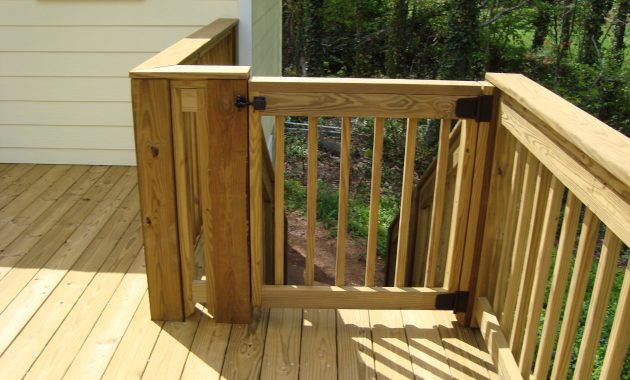
You are a GUI agent. You are given a task and a screenshot of the screen. Output one action in this format:
    pyautogui.click(x=<x>, y=<y>)
    Task: Click on the hinges
    
    Given the screenshot: What is the action you would take?
    pyautogui.click(x=457, y=298), pyautogui.click(x=470, y=110)